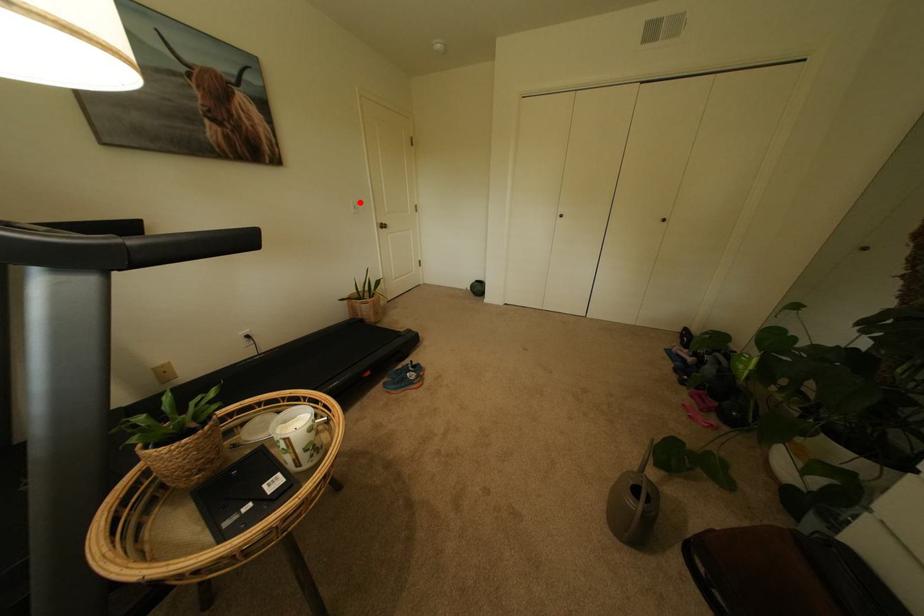
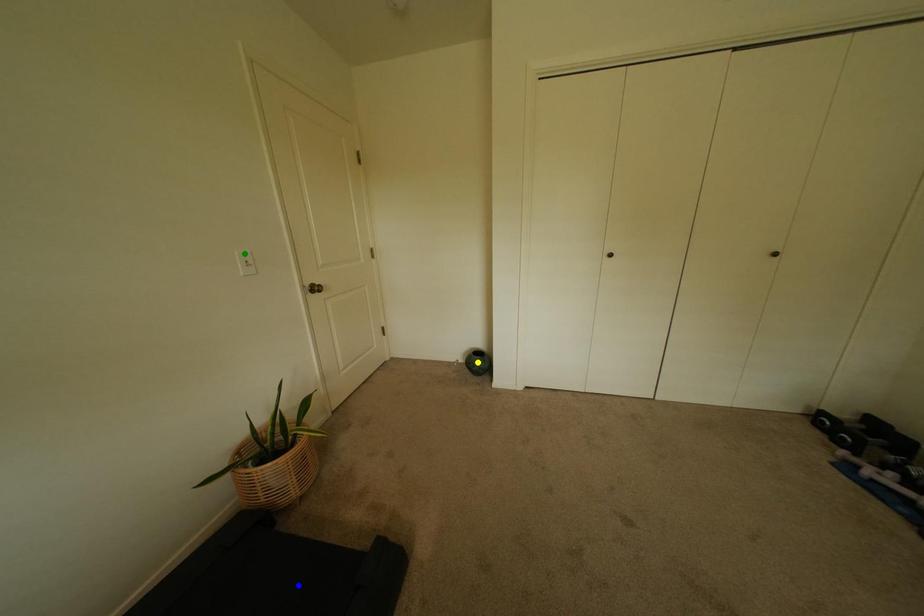
Question: I am providing you with two images of the same scene from different viewpoints. A red point is marked on the first image. You are given multiple points on the second image. Which point in image 2 represents the same 3d spot as the red point in image 1?

Choices:
 (A) blue point
 (B) yellow point
 (C) green point

Answer: (C)